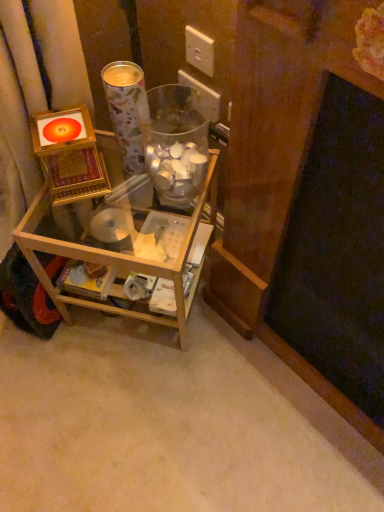
Describe the element at coordinates (117, 260) in the screenshot. I see `clear wood shelf at center` at that location.

Find the location of `clear wood shelf at center`. clear wood shelf at center is located at coordinates (117, 260).

Where is `transparent glass jar at center`? The width and height of the screenshot is (384, 512). transparent glass jar at center is located at coordinates (175, 150).

This screenshot has height=512, width=384. Describe the element at coordinates (125, 111) in the screenshot. I see `metallic paper cup at upper center` at that location.

Where is `white plastic electric outlet at upper center, which ranks as the second electric outlet in back-to-front order`? white plastic electric outlet at upper center, which ranks as the second electric outlet in back-to-front order is located at coordinates (199, 51).

Locate an element on the screen. This screenshot has width=384, height=512. white plastic electric outlet at upper center, the second electric outlet when ordered from front to back is located at coordinates (202, 96).

Considering the sizes of objects white plastic electric outlet at upper center, which ranks as the second electric outlet in back-to-front order, and white plastic electric outlet at upper center, the second electric outlet when ordered from front to back, in the image provided, who is shorter, white plastic electric outlet at upper center, which ranks as the second electric outlet in back-to-front order, or white plastic electric outlet at upper center, the second electric outlet when ordered from front to back,?

white plastic electric outlet at upper center, which ranks as the second electric outlet in back-to-front order, is shorter.

Can you confirm if white plastic electric outlet at upper center, which ranks as the second electric outlet in back-to-front order, is smaller than white plastic electric outlet at upper center, the second electric outlet when ordered from front to back?

Correct, white plastic electric outlet at upper center, which ranks as the second electric outlet in back-to-front order, occupies less space than white plastic electric outlet at upper center, the second electric outlet when ordered from front to back.

Can we say white plastic electric outlet at upper center, which ranks as the second electric outlet in back-to-front order, lies outside white plastic electric outlet at upper center, acting as the 1th electric outlet starting from the back?

Absolutely, white plastic electric outlet at upper center, which ranks as the second electric outlet in back-to-front order, is external to white plastic electric outlet at upper center, acting as the 1th electric outlet starting from the back.

Does metallic paper cup at upper center have a larger size compared to transparent glass jar at center?

No.

Considering the positions of point (128, 77) and point (179, 141), is point (128, 77) closer or farther from the camera than point (179, 141)?

Point (128, 77).

From a real-world perspective, does metallic paper cup at upper center stand above transparent glass jar at center?

Yes.

Considering the sizes of objects metallic paper cup at upper center and transparent glass jar at center in the image provided, who is shorter, metallic paper cup at upper center or transparent glass jar at center?

transparent glass jar at center.

Which of these two, clear wood shelf at center or transparent glass jar at center, stands shorter?

transparent glass jar at center is shorter.

The width and height of the screenshot is (384, 512). Identify the location of furniture below the transparent glass jar at center (from the image's perspective). (117, 260).

Is clear wood shelf at center wider than transparent glass jar at center?

Correct, the width of clear wood shelf at center exceeds that of transparent glass jar at center.

Is clear wood shelf at center positioned far away from transparent glass jar at center?

No, clear wood shelf at center is in close proximity to transparent glass jar at center.

From the picture: Between clear wood shelf at center and metallic paper cup at upper center, which one has less height?

Standing shorter between the two is metallic paper cup at upper center.

Do you think clear wood shelf at center is within metallic paper cup at upper center, or outside of it?

clear wood shelf at center is not inside metallic paper cup at upper center, it's outside.

Is clear wood shelf at center positioned with its back to metallic paper cup at upper center?

No, metallic paper cup at upper center is not at the back of clear wood shelf at center.

In terms of width, does clear wood shelf at center look wider or thinner when compared to metallic paper cup at upper center?

Clearly, clear wood shelf at center has more width compared to metallic paper cup at upper center.

In the image, is transparent glass jar at center on the left side or the right side of white plastic electric outlet at upper center, the second electric outlet when ordered from front to back?

transparent glass jar at center is positioned on white plastic electric outlet at upper center, the second electric outlet when ordered from front to back,'s left side.

Does transparent glass jar at center have a smaller size compared to white plastic electric outlet at upper center, the second electric outlet when ordered from front to back?

No, transparent glass jar at center is not smaller than white plastic electric outlet at upper center, the second electric outlet when ordered from front to back.

From the image's perspective, does transparent glass jar at center appear higher than white plastic electric outlet at upper center, the second electric outlet when ordered from front to back?

No.

Is transparent glass jar at center wider than white plastic electric outlet at upper center, acting as the 1th electric outlet starting from the back?

Yes.

From the image's perspective, which is below, metallic paper cup at upper center or clear wood shelf at center?

From the image's view, clear wood shelf at center is below.

Is metallic paper cup at upper center taller or shorter than clear wood shelf at center?

In the image, metallic paper cup at upper center appears to be shorter than clear wood shelf at center.

From a real-world perspective, is metallic paper cup at upper center physically located above or below clear wood shelf at center?

From a real-world perspective, metallic paper cup at upper center is physically above clear wood shelf at center.

Which is behind, point (143, 84) or point (118, 168)?

The point (118, 168) is farther.

Which point is more distant from viewer, (194,44) or (185,341)?

The point (185,341) is behind.

Could you tell me if white plastic electric outlet at upper center, marked as the first electric outlet in a front-to-back arrangement, is turned towards clear wood shelf at center?

No, white plastic electric outlet at upper center, marked as the first electric outlet in a front-to-back arrangement, is not aimed at clear wood shelf at center.

Is white plastic electric outlet at upper center, marked as the first electric outlet in a front-to-back arrangement, at the right side of clear wood shelf at center?

Correct, you'll find white plastic electric outlet at upper center, marked as the first electric outlet in a front-to-back arrangement, to the right of clear wood shelf at center.

Is white plastic electric outlet at upper center, marked as the first electric outlet in a front-to-back arrangement, wider or thinner than clear wood shelf at center?

Clearly, white plastic electric outlet at upper center, marked as the first electric outlet in a front-to-back arrangement, has less width compared to clear wood shelf at center.

You are a GUI agent. You are given a task and a screenshot of the screen. Output one action in this format:
    pyautogui.click(x=<x>, y=<y>)
    Task: Click on the electric outlet below the white plastic electric outlet at upper center, which ranks as the second electric outlet in back-to-front order (from a real-world perspective)
    The image size is (384, 512).
    Given the screenshot: What is the action you would take?
    pyautogui.click(x=202, y=96)

Find the location of a particular element. The image size is (384, 512). beverage behind the transparent glass jar at center is located at coordinates (125, 111).

Looking at this image, when comparing their distances from metallic paper cup at upper center, does transparent glass jar at center or clear wood shelf at center seem closer?

The object closer to metallic paper cup at upper center is transparent glass jar at center.

Considering their positions, is white plastic electric outlet at upper center, acting as the 1th electric outlet starting from the back, positioned closer to clear wood shelf at center than metallic paper cup at upper center?

metallic paper cup at upper center.

When comparing their distances from white plastic electric outlet at upper center, acting as the 1th electric outlet starting from the back, does clear wood shelf at center or transparent glass jar at center seem further?

clear wood shelf at center is further to white plastic electric outlet at upper center, acting as the 1th electric outlet starting from the back.

Considering their positions, is white plastic electric outlet at upper center, which ranks as the second electric outlet in back-to-front order, positioned closer to white plastic electric outlet at upper center, acting as the 1th electric outlet starting from the back, than metallic paper cup at upper center?

white plastic electric outlet at upper center, which ranks as the second electric outlet in back-to-front order, is positioned closer to the anchor white plastic electric outlet at upper center, acting as the 1th electric outlet starting from the back.

Based on their spatial positions, is clear wood shelf at center or white plastic electric outlet at upper center, marked as the first electric outlet in a front-to-back arrangement, further from metallic paper cup at upper center?

The object further to metallic paper cup at upper center is clear wood shelf at center.

Looking at the image, which one is located closer to transparent glass jar at center, clear wood shelf at center or white plastic electric outlet at upper center, which ranks as the second electric outlet in back-to-front order?

clear wood shelf at center.

Estimate the real-world distances between objects in this image. Which object is further from transparent glass jar at center, white plastic electric outlet at upper center, the second electric outlet when ordered from front to back, or white plastic electric outlet at upper center, marked as the first electric outlet in a front-to-back arrangement?

white plastic electric outlet at upper center, marked as the first electric outlet in a front-to-back arrangement, is positioned further to the anchor transparent glass jar at center.

Estimate the real-world distances between objects in this image. Which object is further from white plastic electric outlet at upper center, marked as the first electric outlet in a front-to-back arrangement, white plastic electric outlet at upper center, acting as the 1th electric outlet starting from the back, or clear wood shelf at center?

clear wood shelf at center is further to white plastic electric outlet at upper center, marked as the first electric outlet in a front-to-back arrangement.

At what (x,y) coordinates should I click in order to perform the action: click on electric outlet that lies between white plastic electric outlet at upper center, marked as the first electric outlet in a front-to-back arrangement, and transparent glass jar at center from top to bottom. Please return your answer as a coordinate pair (x, y). Looking at the image, I should click on (202, 96).

The height and width of the screenshot is (512, 384). In order to click on beverage located between transparent glass jar at center and white plastic electric outlet at upper center, acting as the 1th electric outlet starting from the back, in the depth direction in this screenshot , I will do `click(125, 111)`.

Image resolution: width=384 pixels, height=512 pixels. I want to click on electric outlet between metallic paper cup at upper center and white plastic electric outlet at upper center, acting as the 1th electric outlet starting from the back, from front to back, so click(199, 51).

The image size is (384, 512). In order to click on glass jar between metallic paper cup at upper center and clear wood shelf at center vertically in this screenshot , I will do `click(175, 150)`.